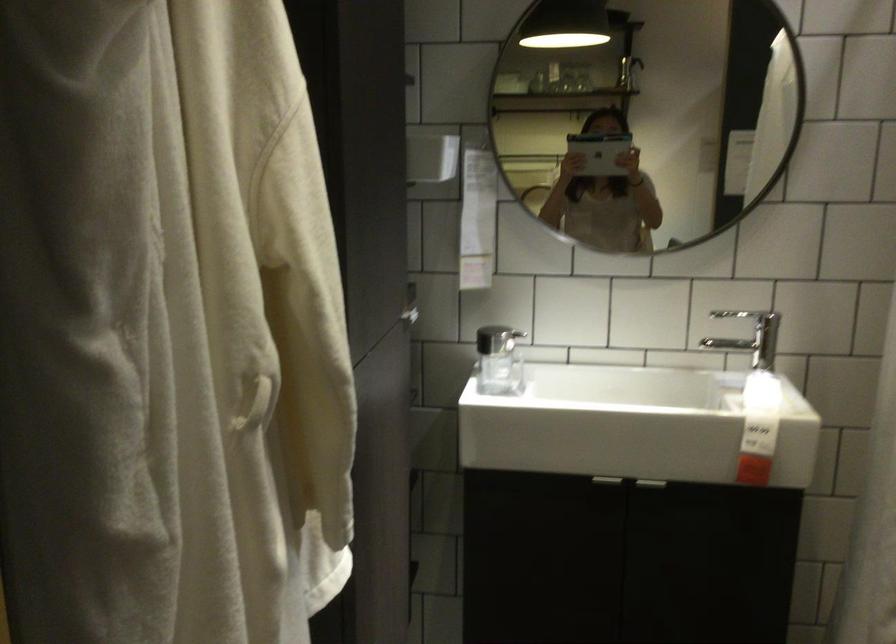
Image resolution: width=896 pixels, height=644 pixels. In order to click on bathrobe hanging loop in this screenshot , I will do `click(254, 406)`.